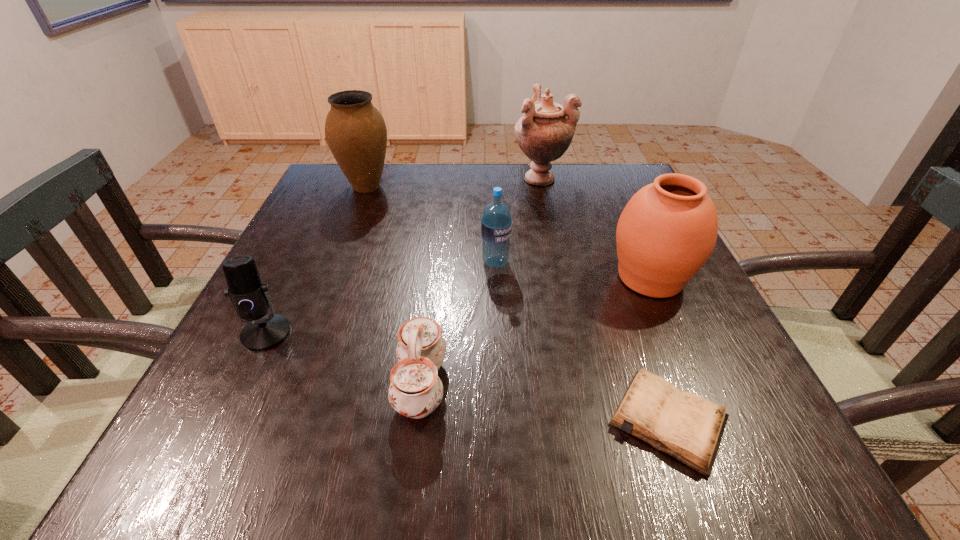
The height and width of the screenshot is (540, 960). Identify the location of diary that is at the right edge. (688, 427).

Image resolution: width=960 pixels, height=540 pixels. I want to click on object that is positioned at the far left corner, so click(x=356, y=133).

This screenshot has width=960, height=540. Find the location of `object present at the near right corner`. object present at the near right corner is located at coordinates (688, 427).

I want to click on free space at the far edge of the desktop, so click(x=395, y=176).

In the image, there is a desktop. Where is `blank space at the near edge`? The height and width of the screenshot is (540, 960). blank space at the near edge is located at coordinates (551, 477).

The width and height of the screenshot is (960, 540). I want to click on free space at the left edge of the desktop, so click(x=331, y=296).

Find the location of `vacant area at the right edge`. vacant area at the right edge is located at coordinates (671, 321).

At what (x,y) coordinates should I click in order to perform the action: click on free space at the near left corner. Please return your answer as a coordinate pair (x, y). Looking at the image, I should click on (174, 436).

Locate an element on the screen. The height and width of the screenshot is (540, 960). free space between the nearest urn and the diary is located at coordinates (660, 349).

You are a GUI agent. You are given a task and a screenshot of the screen. Output one action in this format:
    pyautogui.click(x=<x>, y=<y>)
    Task: Click on the free space between the microphone and the second shortest object
    The height and width of the screenshot is (540, 960).
    Given the screenshot: What is the action you would take?
    pyautogui.click(x=344, y=359)